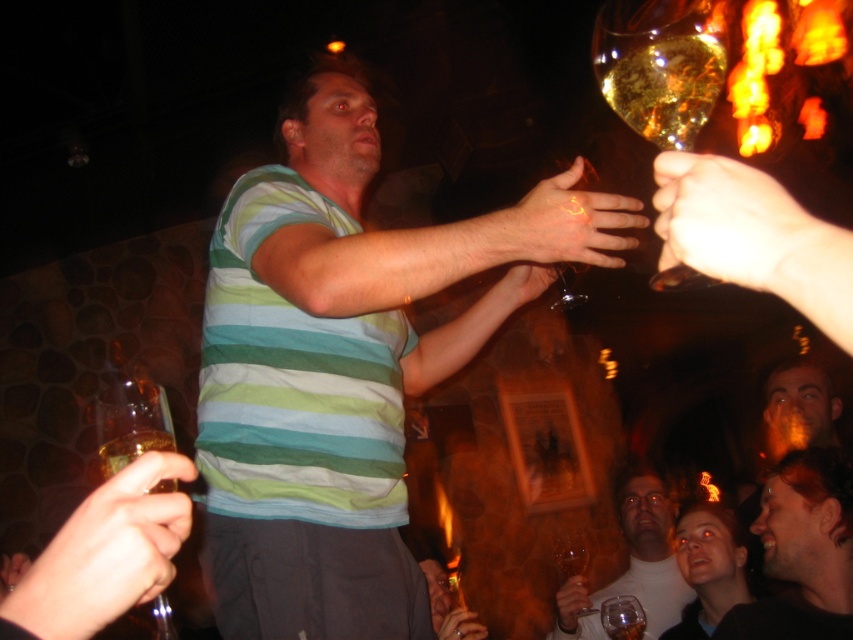
Locate an element on the screen. translucent amber glass at upper center is located at coordinates (572, 580).

At what (x,y) coordinates should I click in order to perform the action: click on translucent amber glass at upper center. Please return your answer as a coordinate pair (x, y). This screenshot has height=640, width=853. Looking at the image, I should click on (572, 580).

Between point (320, 128) and point (631, 67), which one is positioned in front?

Point (631, 67) is in front.

Is striped cotton shirt at center closer to the viewer compared to translucent amber glass at upper right?

No, it is not.

Which is in front, point (380, 296) or point (671, 136)?

Point (671, 136)

Where is `striped cotton shirt at center`? The width and height of the screenshot is (853, 640). striped cotton shirt at center is located at coordinates (344, 364).

Between point (820, 221) and point (163, 442), which one is positioned behind?

The point (163, 442) is behind.

What are the coordinates of `smooth skin hand at upper right` in the screenshot? It's located at (738, 225).

Which is behind, point (758, 186) or point (154, 406)?

The point (154, 406) is more distant.

At what (x,y) coordinates should I click in order to perform the action: click on smooth skin hand at upper right. Please return your answer as a coordinate pair (x, y). The height and width of the screenshot is (640, 853). Looking at the image, I should click on (738, 225).